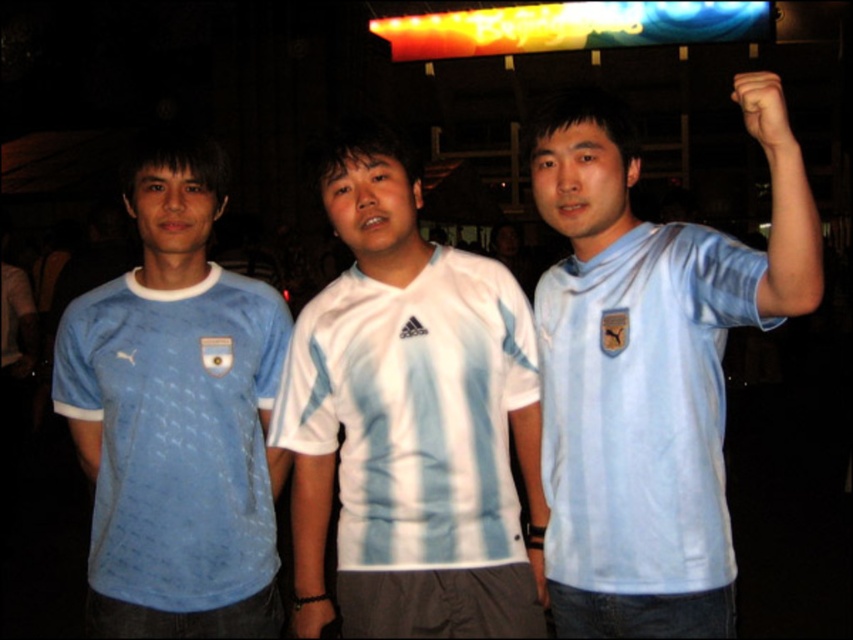
Between light blue jersey at center and white matte jersey at center, which one appears on the left side from the viewer's perspective?

white matte jersey at center

Where is `light blue jersey at center`? The width and height of the screenshot is (853, 640). light blue jersey at center is located at coordinates (643, 378).

Between point (686, 300) and point (317, 529), which one is positioned behind?

Point (317, 529)

Find the location of a particular element. light blue jersey at center is located at coordinates 643,378.

Between white matte jersey at center and matte blue jersey at left, which one is positioned higher?

white matte jersey at center

How far apart are white matte jersey at center and matte blue jersey at left?

white matte jersey at center is 27.00 inches from matte blue jersey at left.

Between point (433, 364) and point (59, 364), which one is positioned in front?

Positioned in front is point (433, 364).

Identify the location of white matte jersey at center. (409, 420).

Can you confirm if white matte jersey at center is positioned above black matte hand at upper right?

No, white matte jersey at center is not above black matte hand at upper right.

Does white matte jersey at center have a smaller size compared to black matte hand at upper right?

Yes.

What do you see at coordinates (409, 420) in the screenshot?
I see `white matte jersey at center` at bounding box center [409, 420].

Where is `white matte jersey at center`? The height and width of the screenshot is (640, 853). white matte jersey at center is located at coordinates (409, 420).